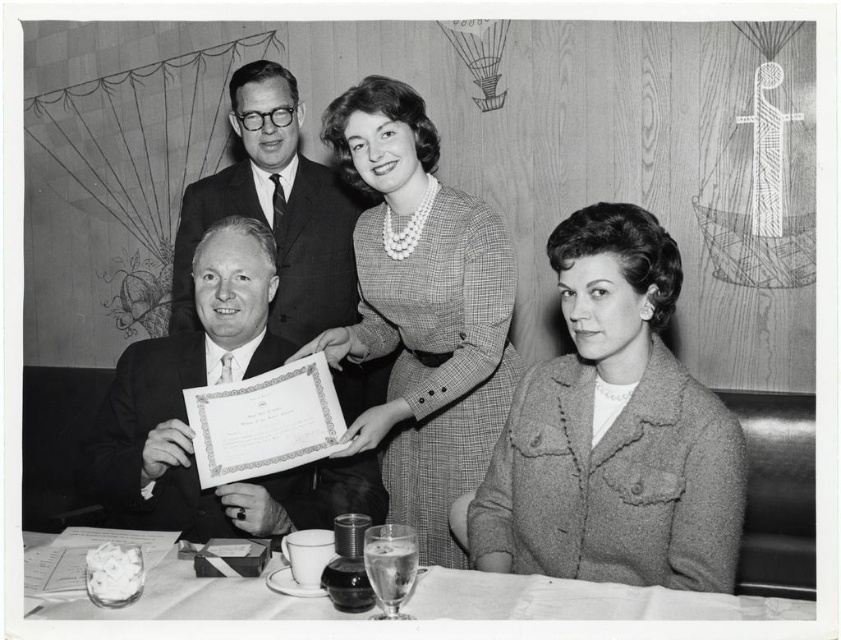
You are a photographer who needs to capture a closeup of the smooth black suit at upper left and the smooth glass table at lower center. Since you can only focus on one object at a time, which one should you focus on first if you want to take a photo from the current angle?

The smooth glass table at lower center is behind the smooth black suit at upper left, so you should focus on the smooth black suit at upper left first because it is closer to the camera.

You are a photographer who wants to capture a closeup of the smooth black suit at upper left without including the woman in the checkered dress with pearl necklace standing to its right. Given that they are 4.26 feet apart, what is the minimum distance you need to move backward from the current position to achieve this?

To avoid including the woman in the checkered dress with pearl necklace standing to the right of the smooth black suit at upper left, you need to move at least 4.26 feet backward from your current position.